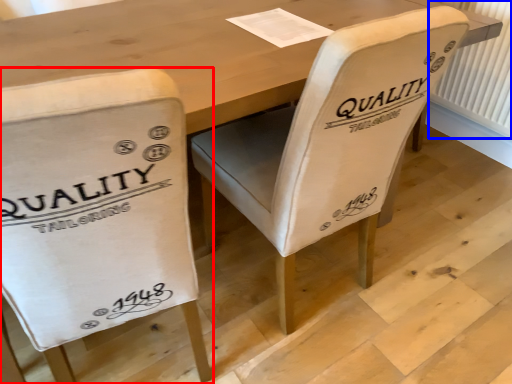
Question: Which object appears farthest to the camera in this image, chair (highlighted by a red box) or radiator (highlighted by a blue box)?

Choices:
 (A) chair
 (B) radiator

Answer: (B)